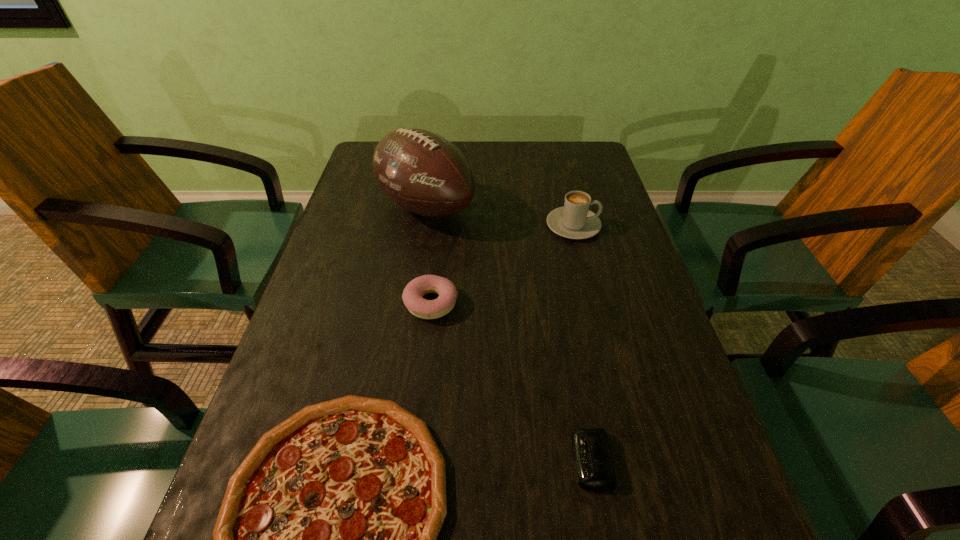
The width and height of the screenshot is (960, 540). I want to click on free space between the tallest object and the second tallest object, so click(x=499, y=217).

Identify the location of vacant area between the alarm clock and the cappuccino. The image size is (960, 540). (582, 343).

Locate an element on the screen. This screenshot has width=960, height=540. empty location between the football (American) and the third farthest object is located at coordinates (428, 255).

The width and height of the screenshot is (960, 540). In order to click on object that is the closest to the second tallest object in this screenshot , I will do tap(424, 173).

Point out which object is positioned as the fourth nearest to the pizza. Please provide its 2D coordinates. Your answer should be formatted as a tuple, i.e. [(x, y)], where the tuple contains the x and y coordinates of a point satisfying the conditions above.

[(574, 220)]